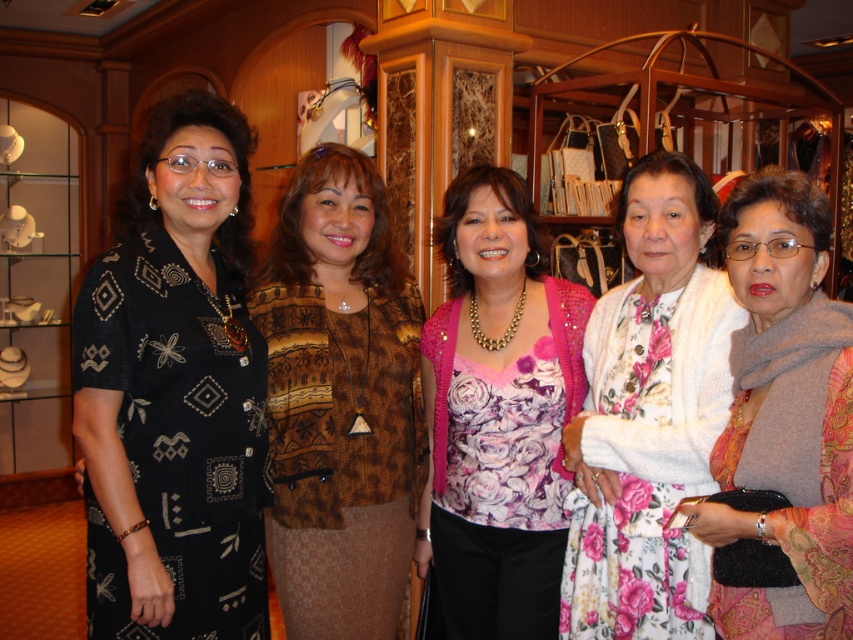
Question: Does brown textured jacket at center appear under gray wool scarf at center?

Choices:
 (A) yes
 (B) no

Answer: (A)

Question: Which object appears farthest from the camera in this image?

Choices:
 (A) black printed dress at left
 (B) brown textured jacket at center
 (C) gray wool scarf at center

Answer: (B)

Question: Where is brown textured jacket at center located in relation to pink floral blouse at center in the image?

Choices:
 (A) above
 (B) below

Answer: (A)

Question: Which of the following is the closest to the observer?

Choices:
 (A) (750, 460)
 (B) (384, 570)
 (C) (544, 554)
 (D) (212, 106)

Answer: (A)

Question: Does brown textured jacket at center appear over gray wool scarf at center?

Choices:
 (A) yes
 (B) no

Answer: (B)

Question: Which point appears farthest from the camera in this image?

Choices:
 (A) (x=735, y=250)
 (B) (x=122, y=547)
 (C) (x=476, y=541)
 (D) (x=650, y=202)

Answer: (C)